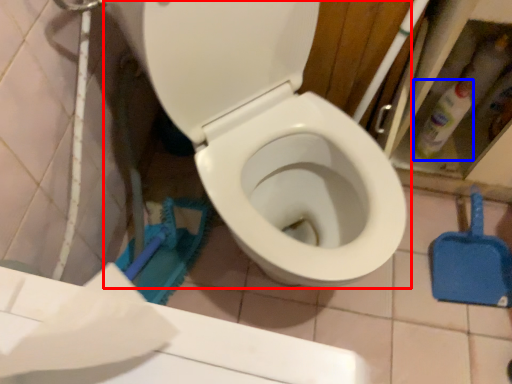
Question: Which point is further to the camera, toilet (highlighted by a red box) or cleaning product (highlighted by a blue box)?

Choices:
 (A) toilet
 (B) cleaning product

Answer: (B)